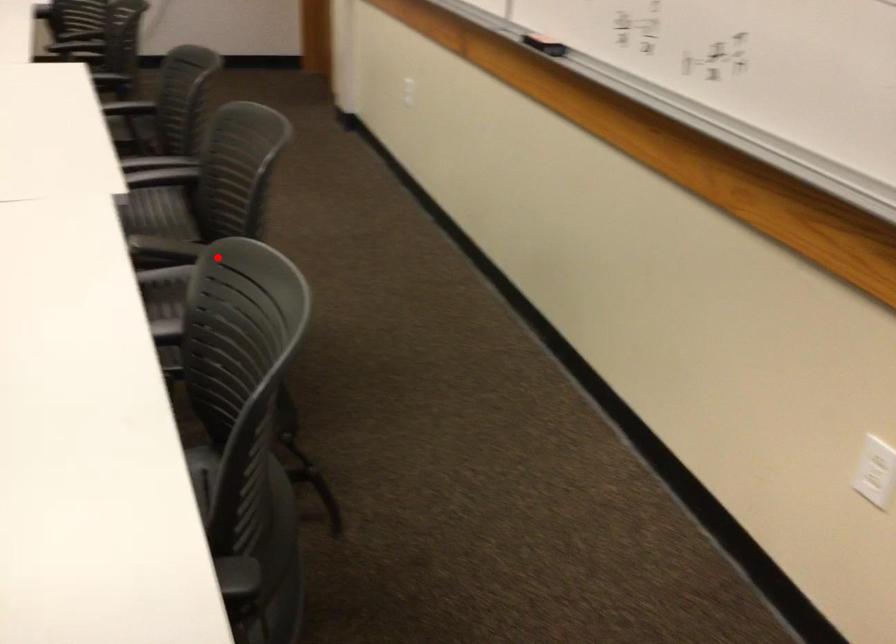
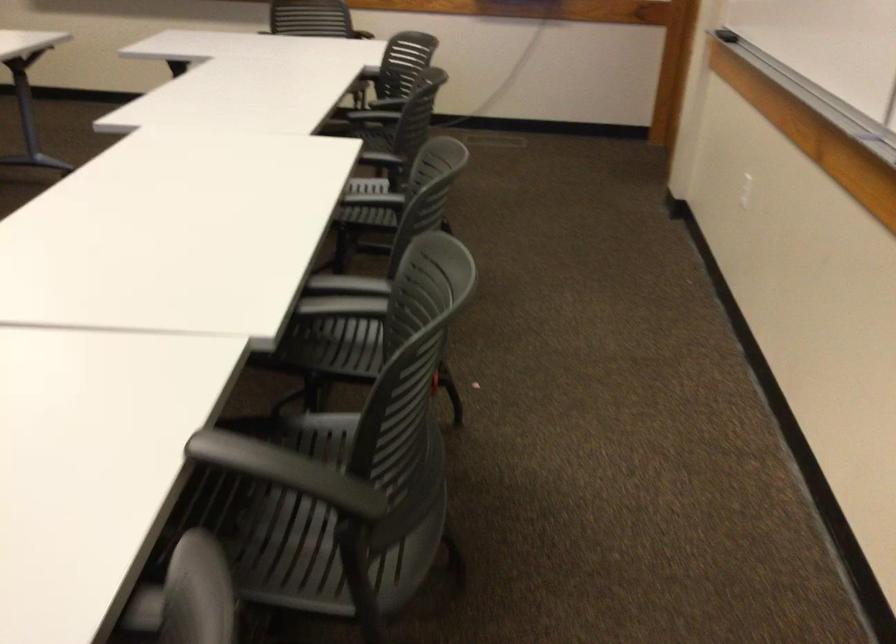
Question: A red point is marked in image1. In image2, is the corresponding 3D point closer to the camera or farther? Reply with the corresponding letter.

Choices:
 (A) The corresponding 3D point is closer.
 (B) The corresponding 3D point is farther.

Answer: (A)